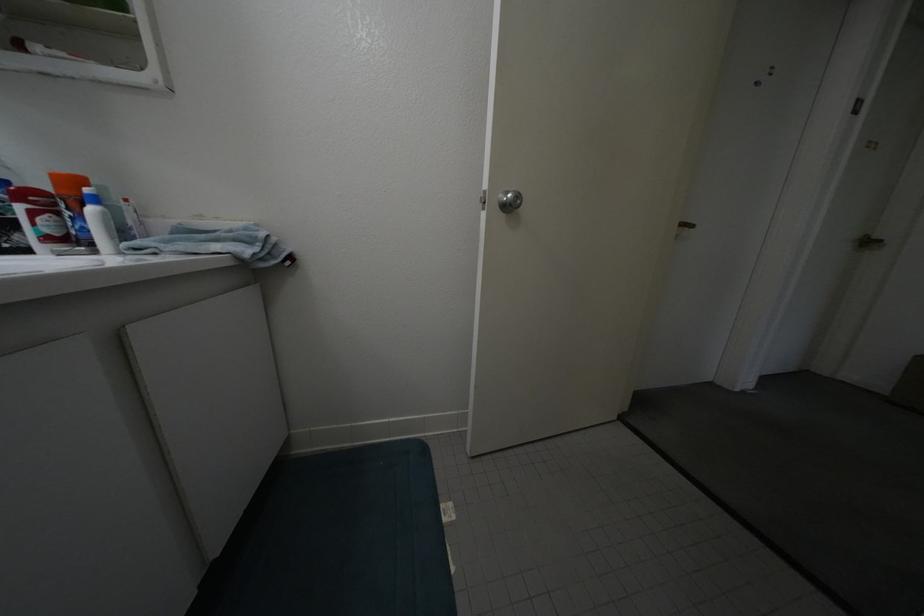
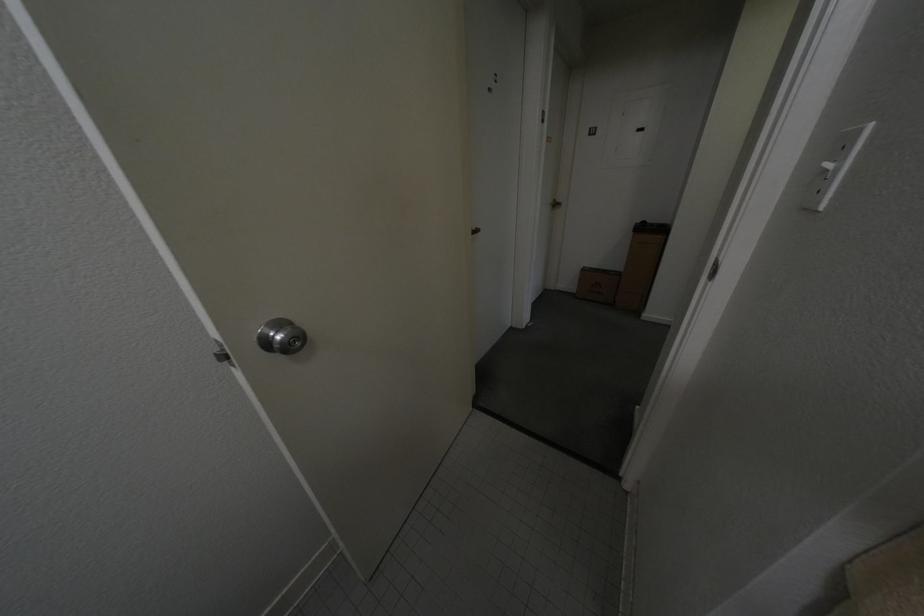
Based on the continuous images, in which direction is the camera rotating?

The rotation direction of the camera is right-down.